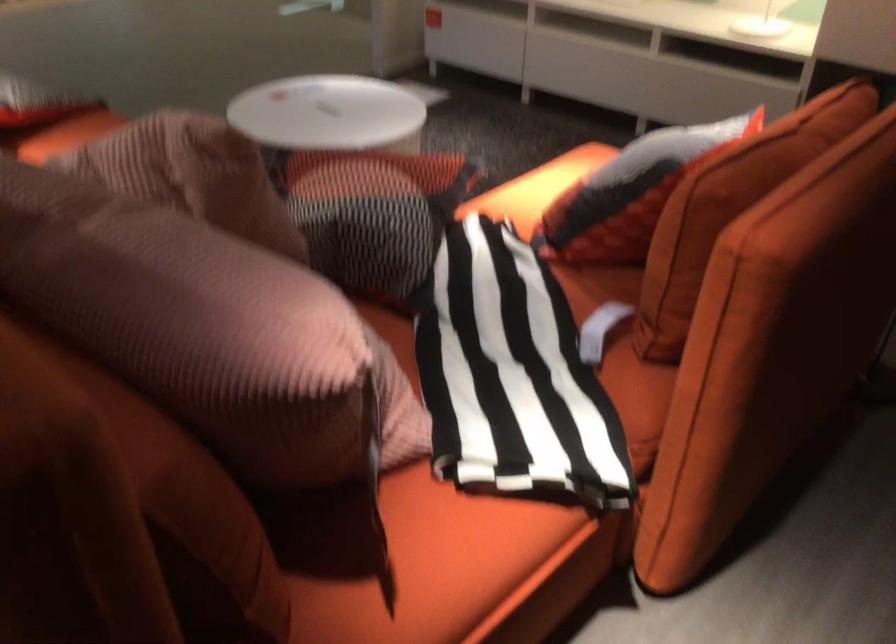
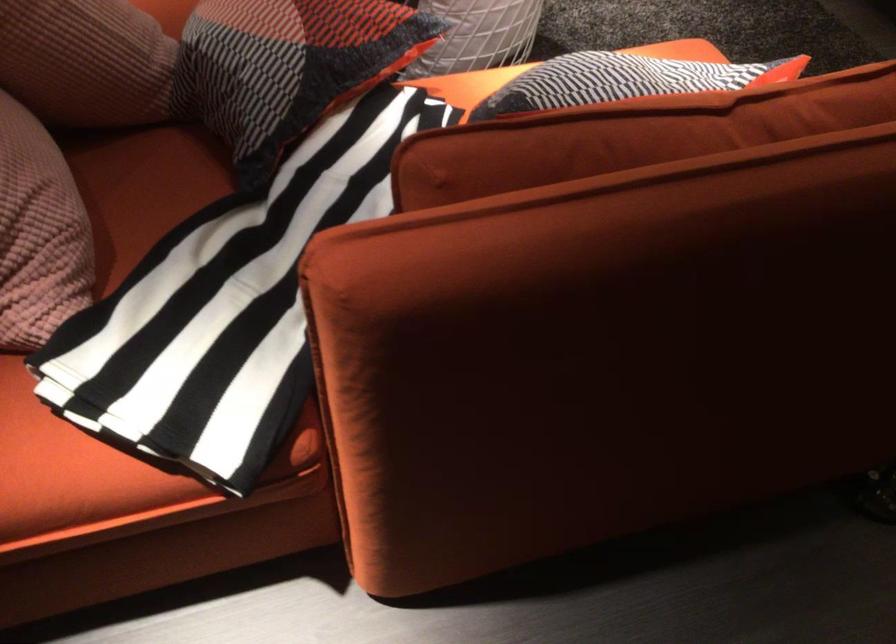
The point at (287, 241) is marked in the first image. Where is the corresponding point in the second image?

(85, 61)